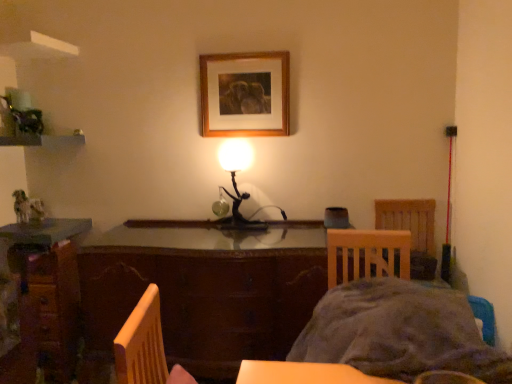
Question: Is wooden chair at right closer to the viewer compared to gray fabric bed at lower right?

Choices:
 (A) yes
 (B) no

Answer: (B)

Question: Is wooden chair at right positioned behind gray fabric bed at lower right?

Choices:
 (A) no
 (B) yes

Answer: (B)

Question: Is wooden chair at right taller than gray fabric bed at lower right?

Choices:
 (A) no
 (B) yes

Answer: (B)

Question: Can you confirm if wooden chair at right is bigger than gray fabric bed at lower right?

Choices:
 (A) yes
 (B) no

Answer: (B)

Question: Is wooden chair at right smaller than gray fabric bed at lower right?

Choices:
 (A) yes
 (B) no

Answer: (A)

Question: Is wooden desk at lower left spatially inside metallic black lamp at center, or outside of it?

Choices:
 (A) outside
 (B) inside

Answer: (A)

Question: Considering the positions of point (47, 286) and point (266, 226), is point (47, 286) closer or farther from the camera than point (266, 226)?

Choices:
 (A) farther
 (B) closer

Answer: (A)

Question: Is wooden desk at lower left in front of or behind metallic black lamp at center in the image?

Choices:
 (A) behind
 (B) front

Answer: (A)

Question: In the image, is wooden desk at lower left on the left side or the right side of metallic black lamp at center?

Choices:
 (A) left
 (B) right

Answer: (A)

Question: From the image's perspective, is gray fabric bed at lower right located above or below metallic black lamp at center?

Choices:
 (A) above
 (B) below

Answer: (B)

Question: Considering the positions of point (384, 321) and point (243, 220), is point (384, 321) closer or farther from the camera than point (243, 220)?

Choices:
 (A) closer
 (B) farther

Answer: (A)

Question: Would you say gray fabric bed at lower right is inside or outside metallic black lamp at center?

Choices:
 (A) outside
 (B) inside

Answer: (A)

Question: From a real-world perspective, is gray fabric bed at lower right above or below metallic black lamp at center?

Choices:
 (A) below
 (B) above

Answer: (A)

Question: Visually, is brown wooden table at center positioned to the left or to the right of wooden chair at right?

Choices:
 (A) right
 (B) left

Answer: (B)

Question: Is brown wooden table at center wider or thinner than wooden chair at right?

Choices:
 (A) thin
 (B) wide

Answer: (B)